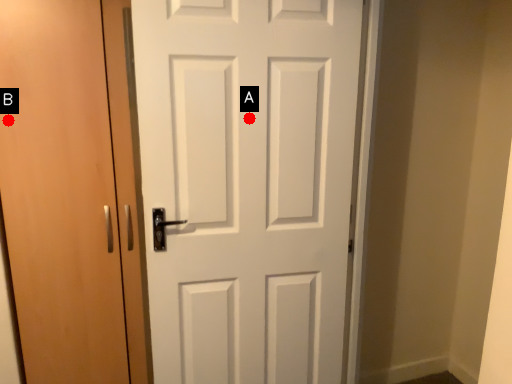
Question: Two points are circled on the image, labeled by A and B beside each circle. Among these points, which one is nearest to the camera?

Choices:
 (A) A is closer
 (B) B is closer

Answer: (B)